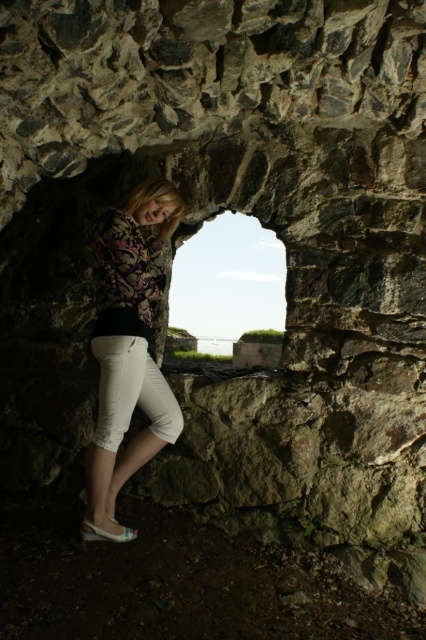
Where is the matte floral blouse at center located in the image?

The matte floral blouse at center is located at point 0.545 on the x axis and 0.300 on the y axis.

You are an architect designing a new archway and want to place a statue exactly where the matte floral blouse at center is currently positioned. What are the coordinates of the spot where you should place the statue?

The coordinates for placing the statue should be at point [127,348] where the matte floral blouse at center is located.